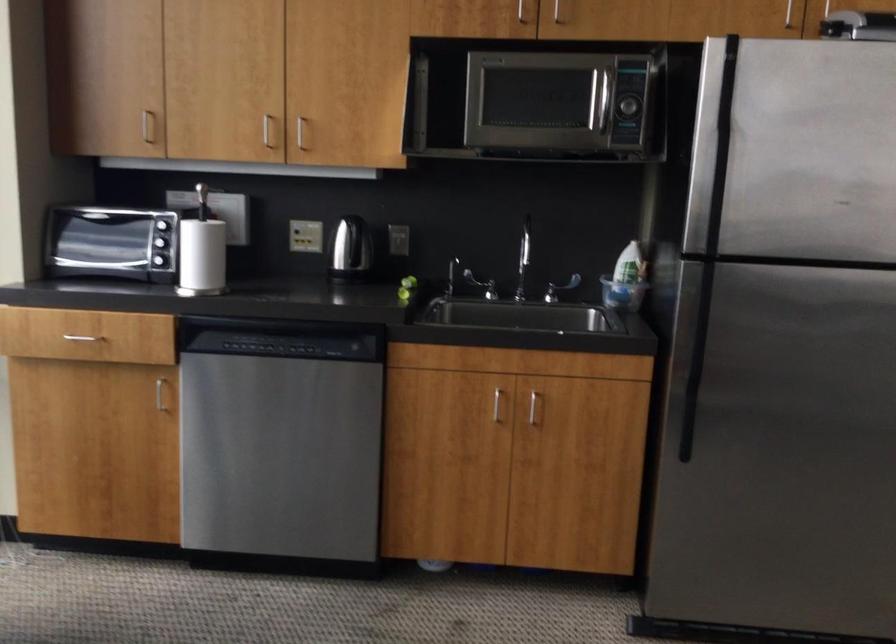
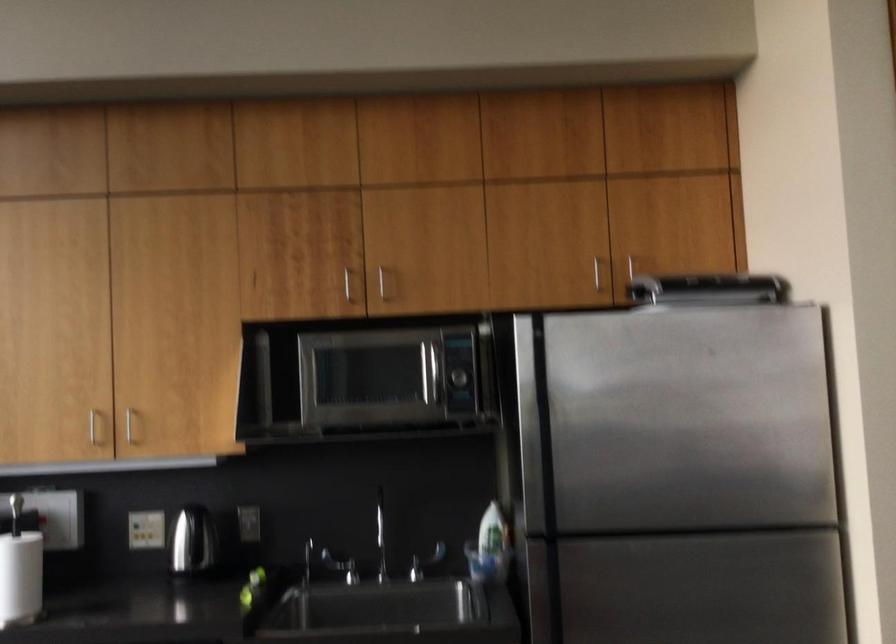
Question: How did the camera likely rotate?

Choices:
 (A) Left
 (B) Right
 (C) Up
 (D) Down

Answer: (C)